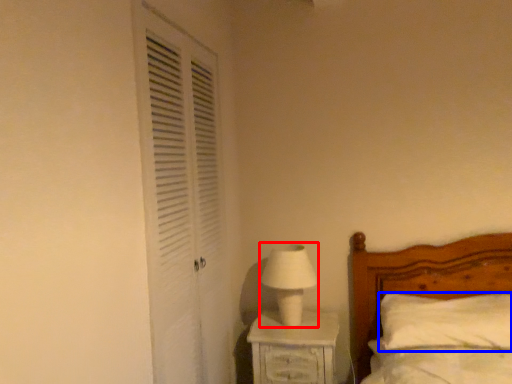
Question: Which object is further to the camera taking this photo, table lamp (highlighted by a red box) or pillow (highlighted by a blue box)?

Choices:
 (A) table lamp
 (B) pillow

Answer: (A)